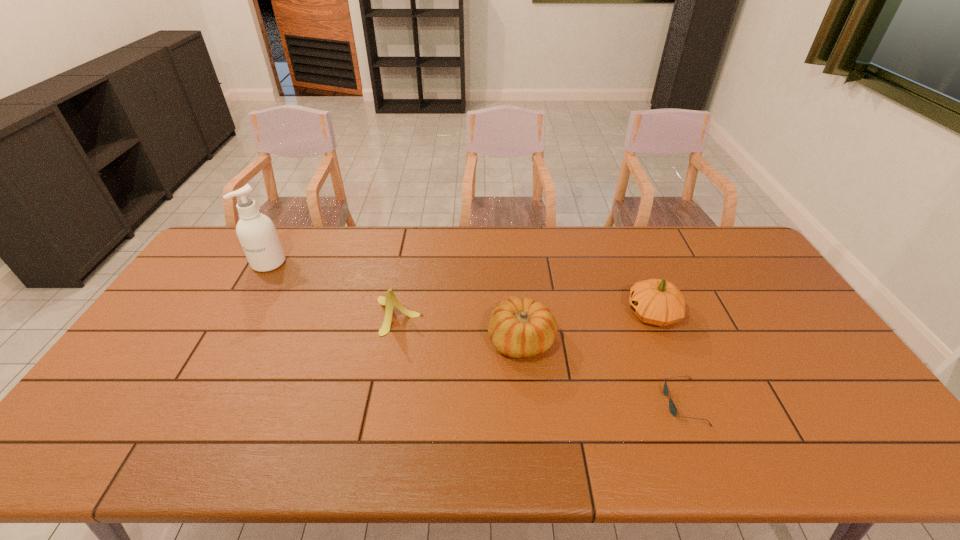
I want to click on free space located 0.240m on the side of the right gourd with the carved face, so click(546, 314).

Locate an element on the screen. The image size is (960, 540). blank space located on the front of the fourth object from right to left is located at coordinates (391, 353).

At what (x,y) coordinates should I click in order to perform the action: click on free space located on the right of the third object from right to left. Please return your answer as a coordinate pair (x, y). The height and width of the screenshot is (540, 960). Looking at the image, I should click on (670, 341).

Find the location of a particular element. The height and width of the screenshot is (540, 960). vacant space situated on the lenses of the sunglasses is located at coordinates (522, 403).

At what (x,y) coordinates should I click in order to perform the action: click on free point located on the lenses of the sunglasses. Please return your answer as a coordinate pair (x, y). This screenshot has width=960, height=540. Looking at the image, I should click on (598, 403).

You are a GUI agent. You are given a task and a screenshot of the screen. Output one action in this format:
    pyautogui.click(x=<x>, y=<y>)
    Task: Click on the free space located 0.200m on the lenses of the sunglasses
    The image size is (960, 540).
    Given the screenshot: What is the action you would take?
    pyautogui.click(x=586, y=403)

Find the location of a particular element. The height and width of the screenshot is (540, 960). object present at the far edge is located at coordinates (256, 232).

Find the location of `free region at the far edge of the desktop`. free region at the far edge of the desktop is located at coordinates (324, 249).

At what (x,y) coordinates should I click in order to perform the action: click on vacant space at the near edge. Please return your answer as a coordinate pair (x, y). The height and width of the screenshot is (540, 960). Looking at the image, I should click on (828, 458).

Where is `vacant area at the left edge`? The height and width of the screenshot is (540, 960). vacant area at the left edge is located at coordinates (128, 368).